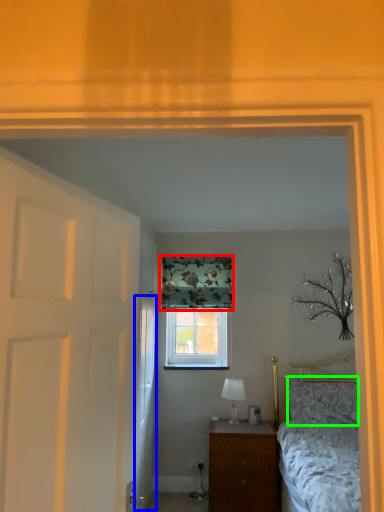
Question: Considering the real-world distances, which object is closest to curtain (highlighted by a red box)? door (highlighted by a blue box) or pillow (highlighted by a green box).

Choices:
 (A) door
 (B) pillow

Answer: (A)